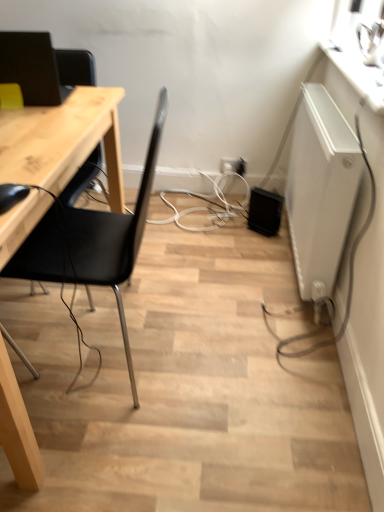
Question: Is black matte chair at left taller than white glossy counter top at upper right?

Choices:
 (A) no
 (B) yes

Answer: (B)

Question: Considering the relative sizes of black matte chair at left and white glossy counter top at upper right in the image provided, is black matte chair at left shorter than white glossy counter top at upper right?

Choices:
 (A) yes
 (B) no

Answer: (B)

Question: From a real-world perspective, is black matte chair at left beneath white glossy counter top at upper right?

Choices:
 (A) yes
 (B) no

Answer: (A)

Question: Is black matte chair at left wider than white glossy counter top at upper right?

Choices:
 (A) yes
 (B) no

Answer: (A)

Question: Is the surface of black matte chair at left in direct contact with white glossy counter top at upper right?

Choices:
 (A) yes
 (B) no

Answer: (B)

Question: Considering the relative sizes of black matte chair at left and white glossy counter top at upper right in the image provided, is black matte chair at left smaller than white glossy counter top at upper right?

Choices:
 (A) yes
 (B) no

Answer: (B)

Question: Is white plastic electric outlet at center, acting as the 1th electric outlet starting from the right, taller than white plastic electric outlet at center, the 2th electric outlet from the right?

Choices:
 (A) no
 (B) yes

Answer: (B)

Question: Is white plastic electric outlet at center, acting as the 1th electric outlet starting from the right, completely or partially outside of white plastic electric outlet at center, the 2th electric outlet from the right?

Choices:
 (A) yes
 (B) no

Answer: (A)

Question: From the image's perspective, is white plastic electric outlet at center, marked as the second electric outlet in a left-to-right arrangement, on white plastic electric outlet at center, which is the first electric outlet in left-to-right order?

Choices:
 (A) no
 (B) yes

Answer: (A)

Question: Is white plastic electric outlet at center, which is the first electric outlet in left-to-right order, completely or partially inside white plastic electric outlet at center, acting as the 1th electric outlet starting from the right?

Choices:
 (A) no
 (B) yes

Answer: (A)

Question: Is white plastic electric outlet at center, marked as the second electric outlet in a left-to-right arrangement, aimed at white plastic electric outlet at center, which is the first electric outlet in left-to-right order?

Choices:
 (A) yes
 (B) no

Answer: (B)

Question: Is the depth of white plastic electric outlet at center, marked as the second electric outlet in a left-to-right arrangement, greater than that of white plastic electric outlet at center, the 2th electric outlet from the right?

Choices:
 (A) yes
 (B) no

Answer: (B)

Question: Is matte black monitor at upper left at the left side of black matte chair at left?

Choices:
 (A) no
 (B) yes

Answer: (B)